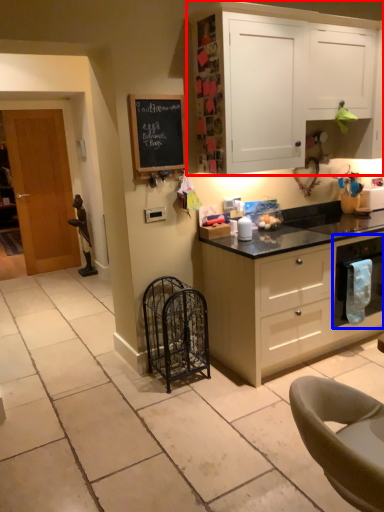
Question: Which point is closer to the camera, cabinetry (highlighted by a red box) or kitchen appliance (highlighted by a blue box)?

Choices:
 (A) cabinetry
 (B) kitchen appliance

Answer: (A)